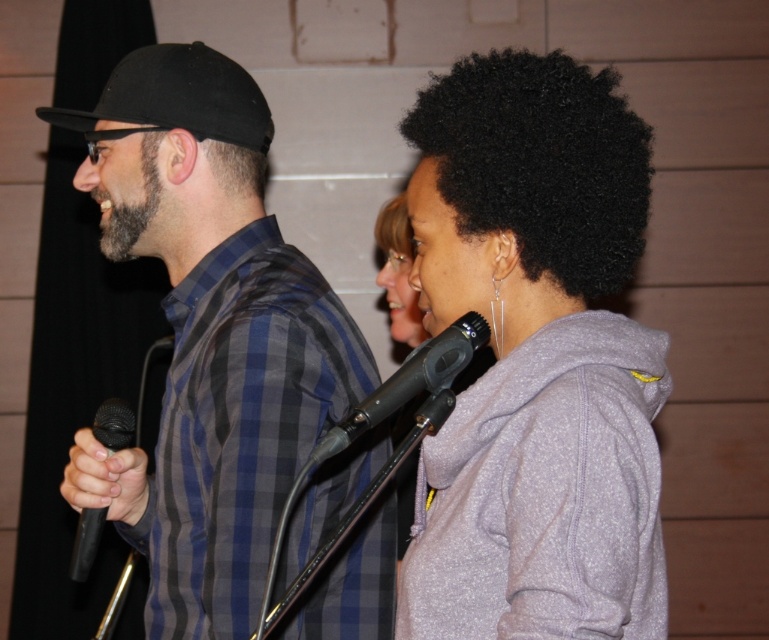
You are a stage director trying to adjust the lighting for the performance. You need to ensure that the spotlight focuses on the person closer to the audience. Which point should you aim the spotlight at, point (608, 220) or point (258, 115)?

Point (608, 220) is in front of point (258, 115), so the spotlight should be aimed at point (608, 220) to focus on the person closer to the audience.

You are a photographer taking a picture of the two performers. You notice the plaid shirt at left and the black matte microphone at left. Which one is higher in the image?

The plaid shirt at left is above the black matte microphone at left, so the plaid shirt at left is higher in the image.

You are an audience member sitting in the front row of a live performance. You notice the plaid shirt at left and the black matte microphone at left. Which object is positioned closer to your perspective?

The plaid shirt at left is closer to the viewer than the black matte microphone at left, so the plaid shirt at left is positioned closer to your perspective.